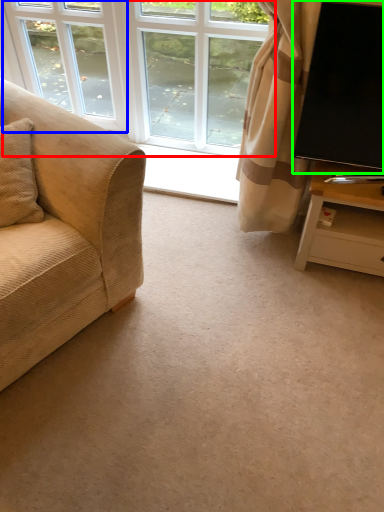
Question: Which object is positioned closest to window (highlighted by a red box)? Select from window (highlighted by a blue box) and television (highlighted by a green box).

Choices:
 (A) window
 (B) television

Answer: (A)